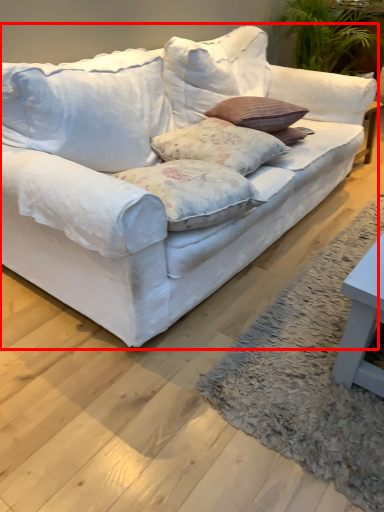
Question: Observing the image, what is the correct spatial positioning of studio couch (annotated by the red box) in reference to pillow?

Choices:
 (A) left
 (B) right

Answer: (A)